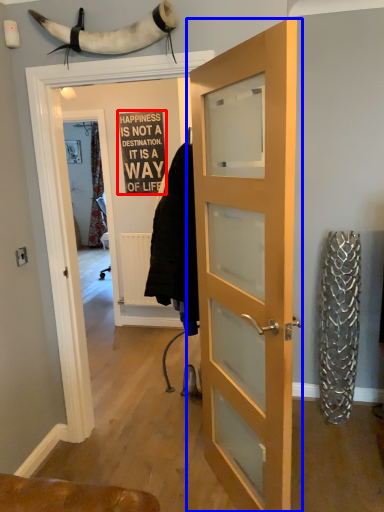
Question: Which object is closer to the camera taking this photo, writing (highlighted by a red box) or door (highlighted by a blue box)?

Choices:
 (A) writing
 (B) door

Answer: (B)